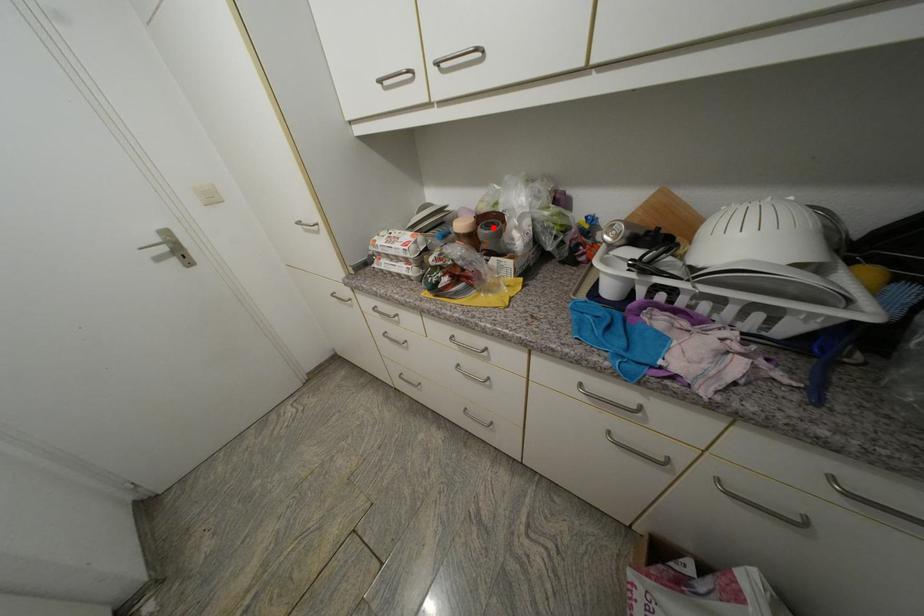
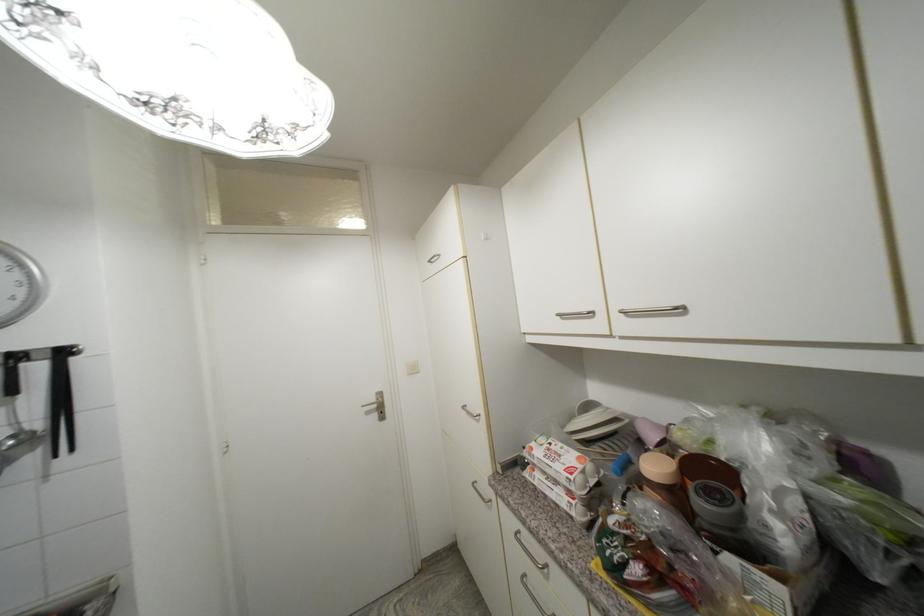
Where in the second image is the point corresponding to the highlighted location from the first image?

(714, 496)